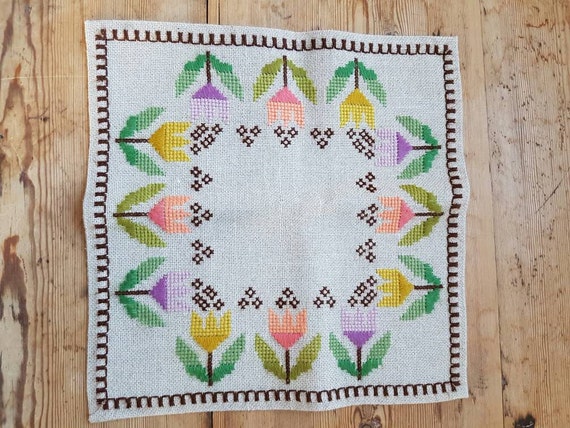
The height and width of the screenshot is (428, 570). In order to click on wood surface in this screenshot , I will do `click(500, 207)`.